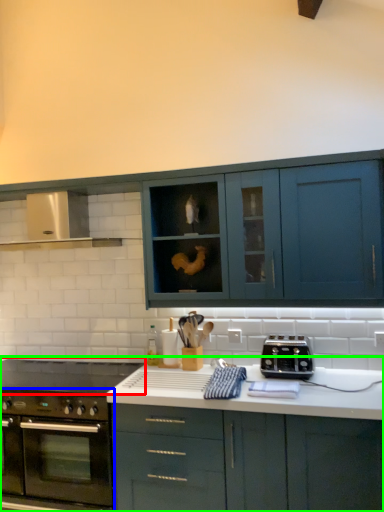
Question: Which is farther away from gas stove (highlighted by a red box)? oven (highlighted by a blue box) or cabinetry (highlighted by a green box)?

Choices:
 (A) oven
 (B) cabinetry

Answer: (B)